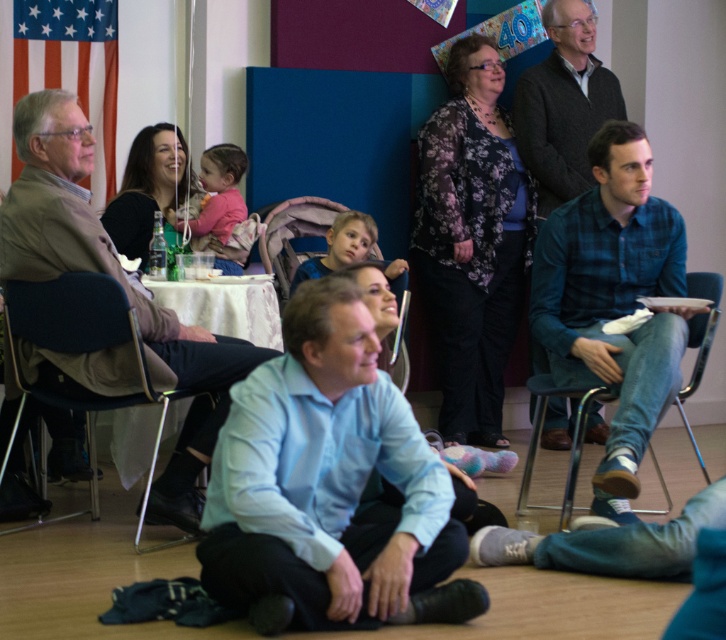
Question: Is metallic silver chair at lower left below metallic blue chair at right?

Choices:
 (A) yes
 (B) no

Answer: (B)

Question: Which object is positioned farthest from the blue plaid shirt at center?

Choices:
 (A) metallic blue chair at right
 (B) metallic silver chair at lower left

Answer: (B)

Question: Does matte brown jacket at left lie behind metallic blue chair at right?

Choices:
 (A) no
 (B) yes

Answer: (A)

Question: Is matte brown jacket at left to the left of metallic silver chair at lower left from the viewer's perspective?

Choices:
 (A) no
 (B) yes

Answer: (A)

Question: Which object is positioned closest to the blue plaid shirt at center?

Choices:
 (A) metallic silver chair at lower left
 (B) metallic blue chair at right
 (C) matte plastic chair at center
 (D) matte brown jacket at left

Answer: (C)

Question: Considering the real-world distances, which object is farthest from the blue plaid shirt at center?

Choices:
 (A) matte brown jacket at left
 (B) light blue shirt at center

Answer: (B)